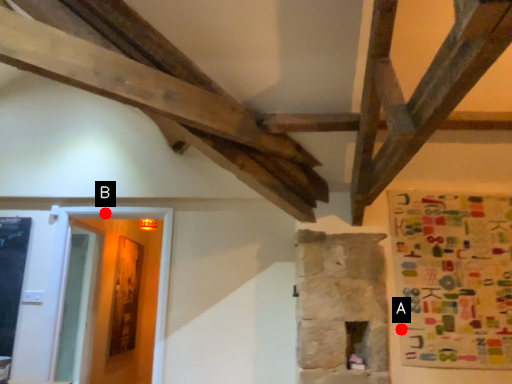
Question: Two points are circled on the image, labeled by A and B beside each circle. Which of the following is the closest to the observer?

Choices:
 (A) A is closer
 (B) B is closer

Answer: (A)